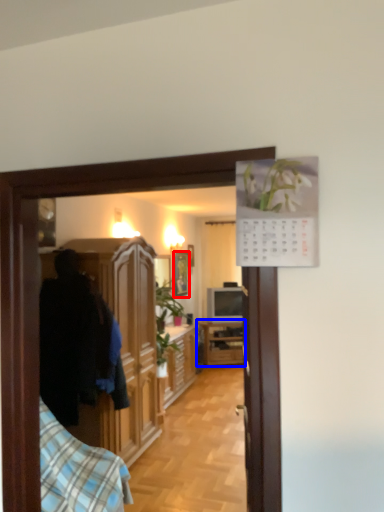
Question: Which object is closer to the camera taking this photo, picture frame (highlighted by a red box) or cabinetry (highlighted by a blue box)?

Choices:
 (A) picture frame
 (B) cabinetry

Answer: (A)